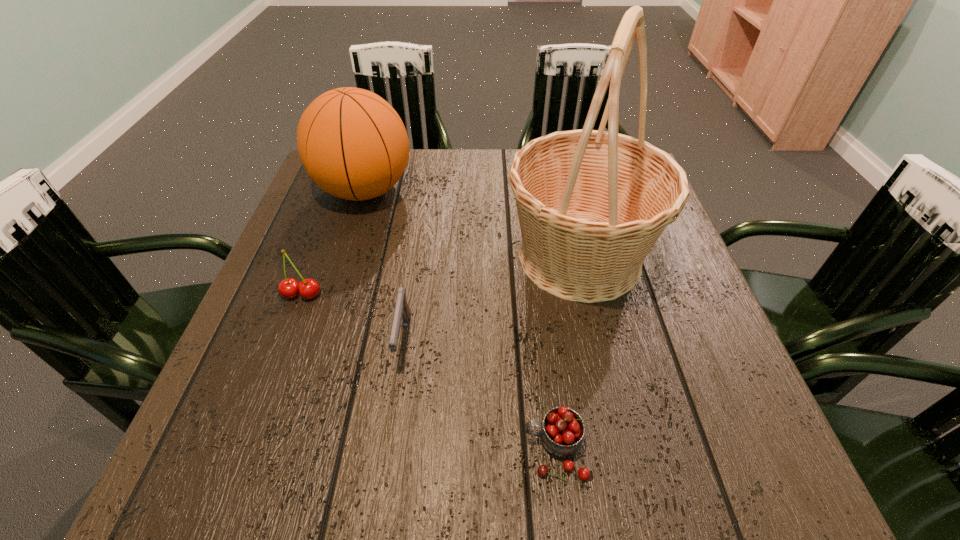
The height and width of the screenshot is (540, 960). What are the coordinates of `the tallest object` in the screenshot? It's located at (591, 204).

The width and height of the screenshot is (960, 540). I want to click on basketball, so click(x=352, y=143).

This screenshot has width=960, height=540. What are the coordinates of `the farther cherry` in the screenshot? It's located at (308, 288).

You are a GUI agent. You are given a task and a screenshot of the screen. Output one action in this format:
    pyautogui.click(x=<x>, y=<y>)
    Task: Click on the nearest object
    
    Given the screenshot: What is the action you would take?
    562,431

You are a GUI agent. You are given a task and a screenshot of the screen. Output one action in this format:
    pyautogui.click(x=<x>, y=<y>)
    Task: Click on the nearer cherry
    
    Given the screenshot: What is the action you would take?
    pyautogui.click(x=562, y=431)

Image resolution: width=960 pixels, height=540 pixels. What are the coordinates of `the third object from left to right` in the screenshot? It's located at (402, 310).

In order to click on vacant space situated on the back of the tallest object in this screenshot , I will do `click(561, 173)`.

Identify the location of vacant space located on the right of the basketball. (524, 191).

Locate an element on the screen. The height and width of the screenshot is (540, 960). vacant space located 0.130m with the stems of the farther cherry pointing upwards is located at coordinates (278, 357).

Identify the location of free space located on the handle side of the nearer cherry. (460, 450).